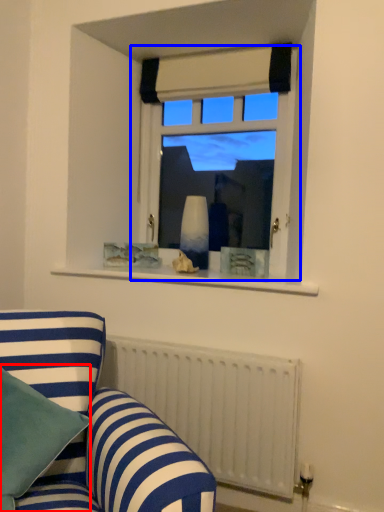
Question: Among these objects, which one is nearest to the camera, pillow (highlighted by a red box) or window (highlighted by a blue box)?

Choices:
 (A) pillow
 (B) window

Answer: (A)